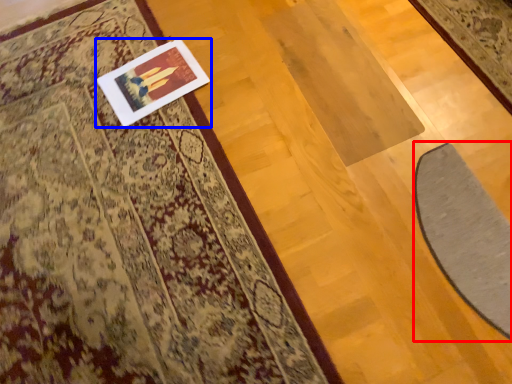
Question: Which point is closer to the camera, doormat (highlighted by a red box) or picture frame (highlighted by a blue box)?

Choices:
 (A) doormat
 (B) picture frame

Answer: (A)